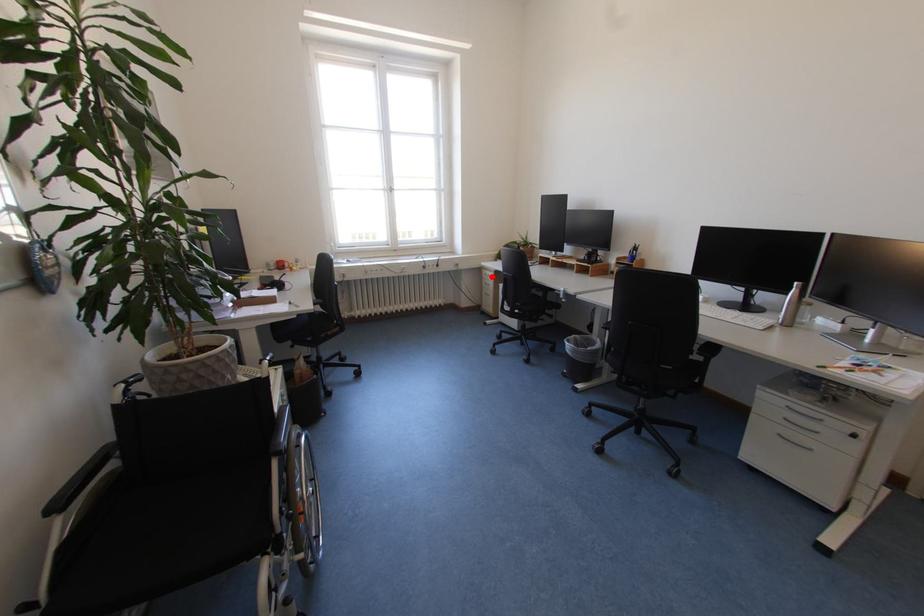
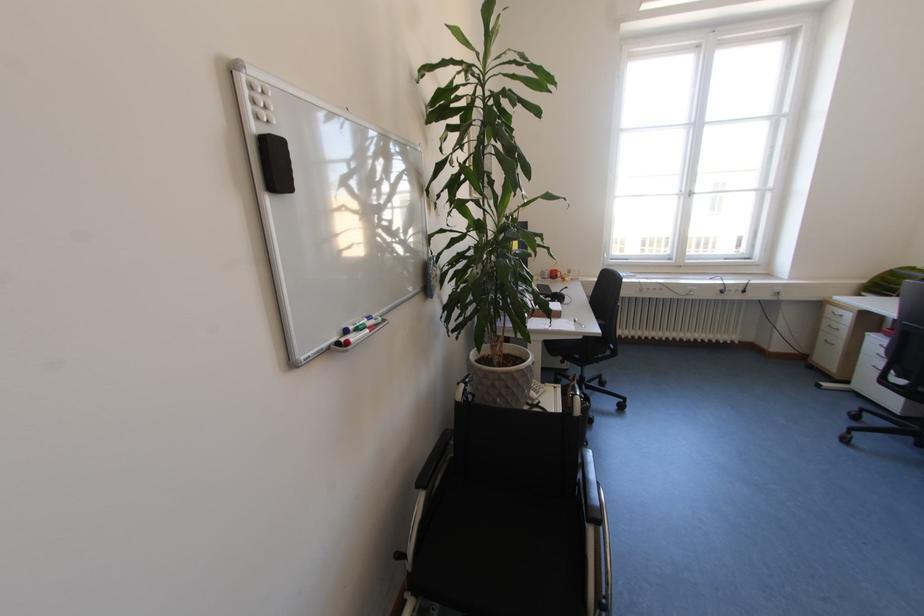
Question: I am providing you with two images of the same scene from different viewpoints. In image1, a red point is highlighted. Considering the same 3D point in image2, which of the following is correct?

Choices:
 (A) It is closer
 (B) It is farther

Answer: (B)